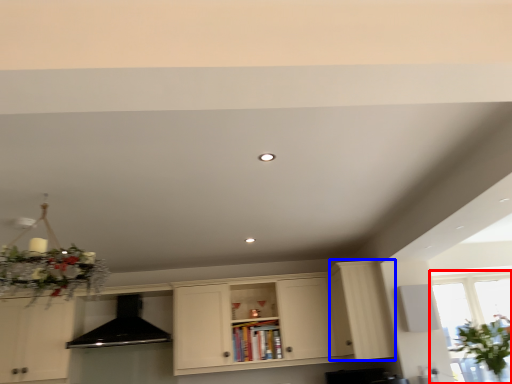
Question: Which of the following is the farthest to the observer, window (highlighted by a red box) or cabinetry (highlighted by a blue box)?

Choices:
 (A) window
 (B) cabinetry

Answer: (B)